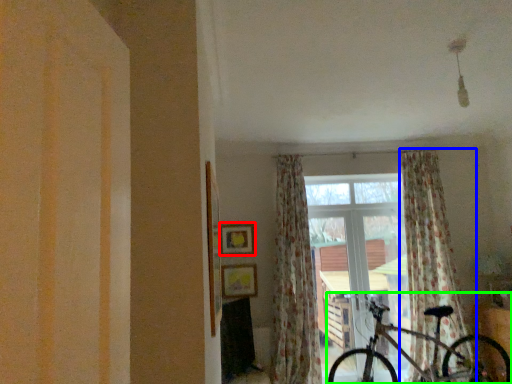
Question: Which object is positioned closest to picture frame (highlighted by a red box)? Select from curtain (highlighted by a blue box) and bicycle (highlighted by a green box).

Choices:
 (A) curtain
 (B) bicycle

Answer: (B)